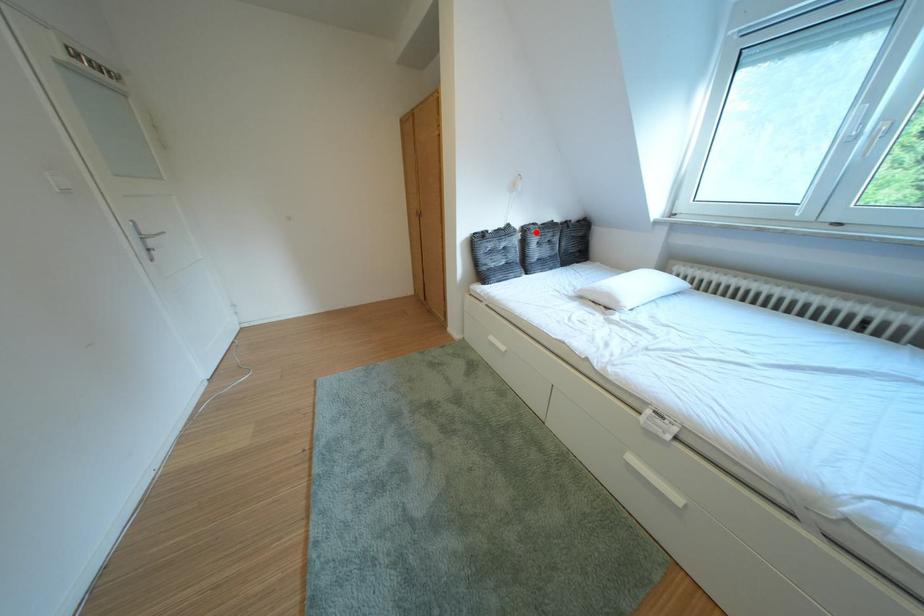
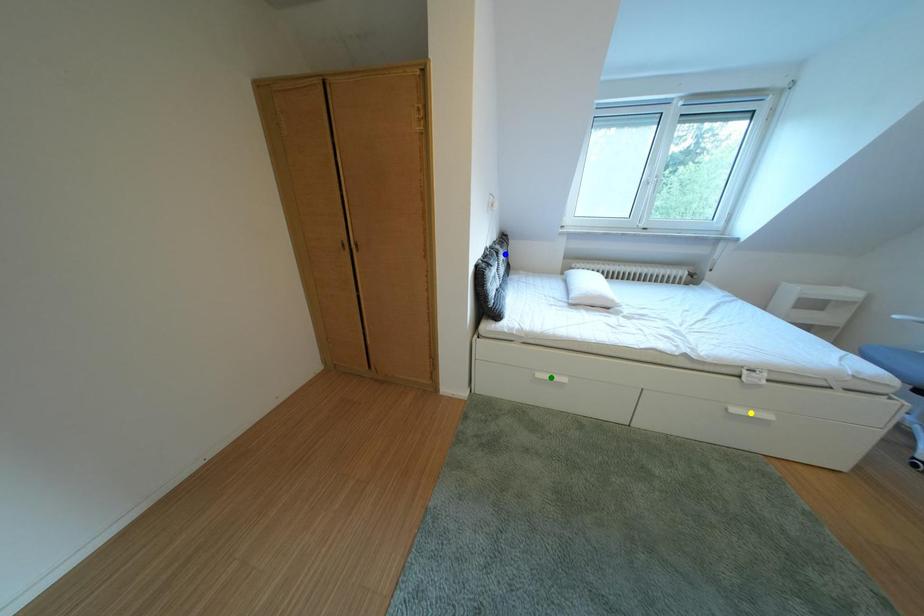
Question: I am providing you with two images of the same scene from different viewpoints. A red point is marked on the first image. You are given multiple points on the second image. Can you choose the point in image 2 that corresponds to the point in image 1?

Choices:
 (A) blue point
 (B) yellow point
 (C) green point

Answer: (A)